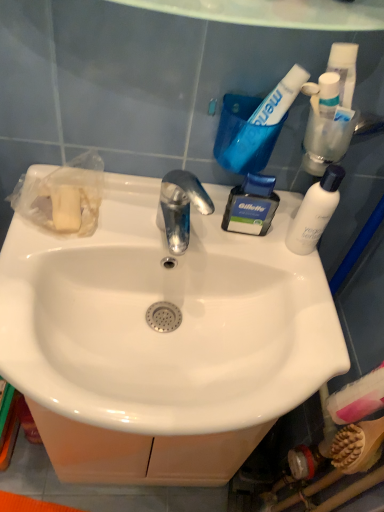
Find the location of a particular element. Image resolution: width=384 pixels, height=512 pixels. free location in front of white matte bottle at upper right is located at coordinates (301, 316).